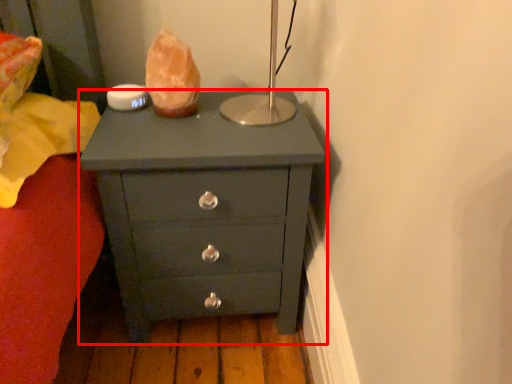
Question: Considering the relative positions of chest of drawers (annotated by the red box) and food in the image provided, where is chest of drawers (annotated by the red box) located with respect to the staircase?

Choices:
 (A) left
 (B) right

Answer: (B)